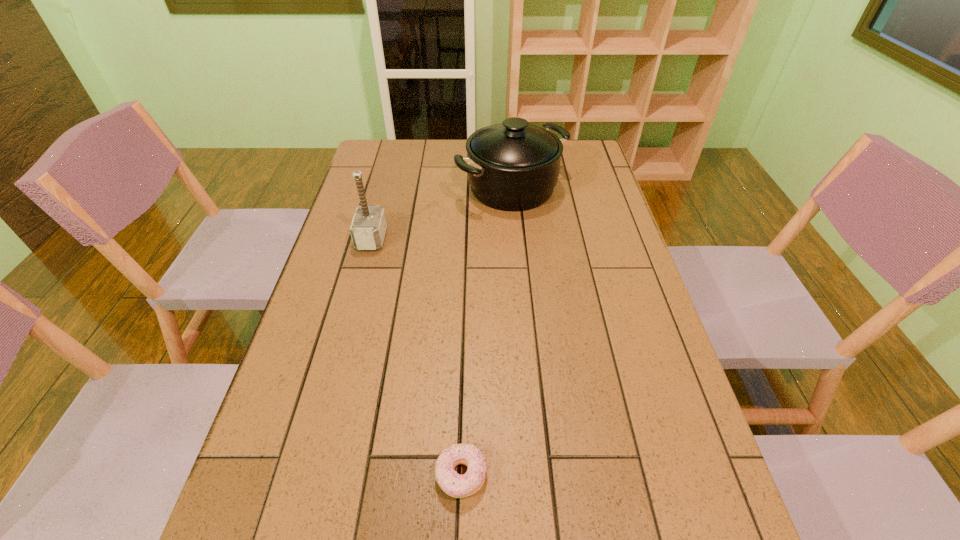
Where is `empty location between the farthest object and the nearest object`? The image size is (960, 540). empty location between the farthest object and the nearest object is located at coordinates pyautogui.click(x=487, y=332).

You are a GUI agent. You are given a task and a screenshot of the screen. Output one action in this format:
    pyautogui.click(x=<x>, y=<y>)
    Task: Click on the free spot between the second farthest object and the farthest object
    
    Given the screenshot: What is the action you would take?
    pyautogui.click(x=442, y=213)

You are a GUI agent. You are given a task and a screenshot of the screen. Output one action in this format:
    pyautogui.click(x=<x>, y=<y>)
    Task: Click on the free space between the nearest object and the second nearest object
    The height and width of the screenshot is (540, 960).
    Given the screenshot: What is the action you would take?
    pyautogui.click(x=417, y=357)

Where is `free space that is in between the farthest object and the leftmost object`? This screenshot has width=960, height=540. free space that is in between the farthest object and the leftmost object is located at coordinates (442, 213).

Locate an element on the screen. The height and width of the screenshot is (540, 960). vacant point located between the second nearest object and the saucepan is located at coordinates (442, 213).

Locate an element on the screen. The height and width of the screenshot is (540, 960). object that is the second closest to the leftmost object is located at coordinates (455, 485).

The width and height of the screenshot is (960, 540). In order to click on object that is the closest one to the hammer in this screenshot , I will do `click(513, 166)`.

Where is `blank area in the image that satisfies the following two spatial constraints: 1. for striking with the head of the second farthest object; 2. on the back side of the shortest object`? The height and width of the screenshot is (540, 960). blank area in the image that satisfies the following two spatial constraints: 1. for striking with the head of the second farthest object; 2. on the back side of the shortest object is located at coordinates (308, 475).

Image resolution: width=960 pixels, height=540 pixels. In order to click on free region that satisfies the following two spatial constraints: 1. for striking with the head of the hammer; 2. on the right side of the nearest object in this screenshot , I will do `click(308, 475)`.

Where is `free space that satisfies the following two spatial constraints: 1. for striking with the head of the doughnut; 2. on the left side of the second nearest object`? This screenshot has height=540, width=960. free space that satisfies the following two spatial constraints: 1. for striking with the head of the doughnut; 2. on the left side of the second nearest object is located at coordinates (308, 475).